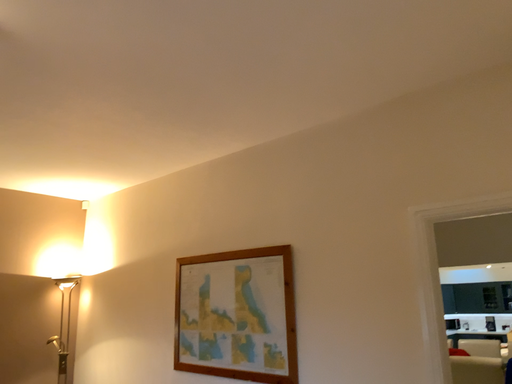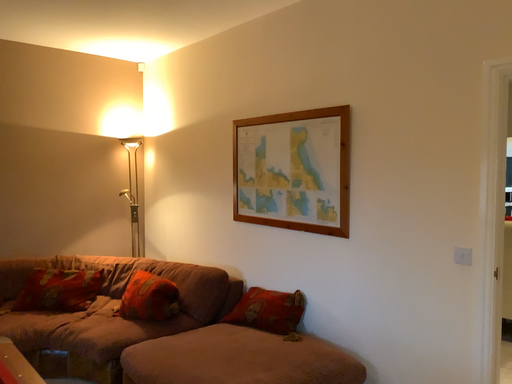
Question: How did the camera likely rotate when shooting the video?

Choices:
 (A) rotated right
 (B) rotated left

Answer: (B)